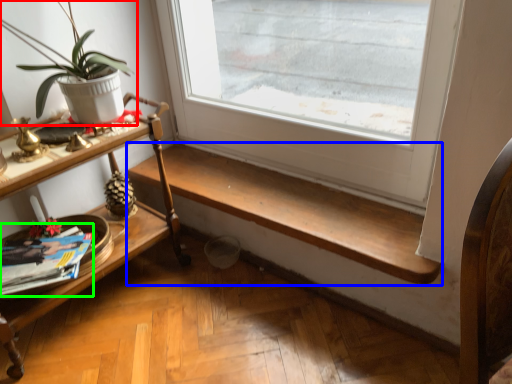
Question: Based on their relative distances, which object is nearer to houseplant (highlighted by a red box)? Choose from stairwell (highlighted by a blue box) and magazine (highlighted by a green box).

Choices:
 (A) stairwell
 (B) magazine

Answer: (B)